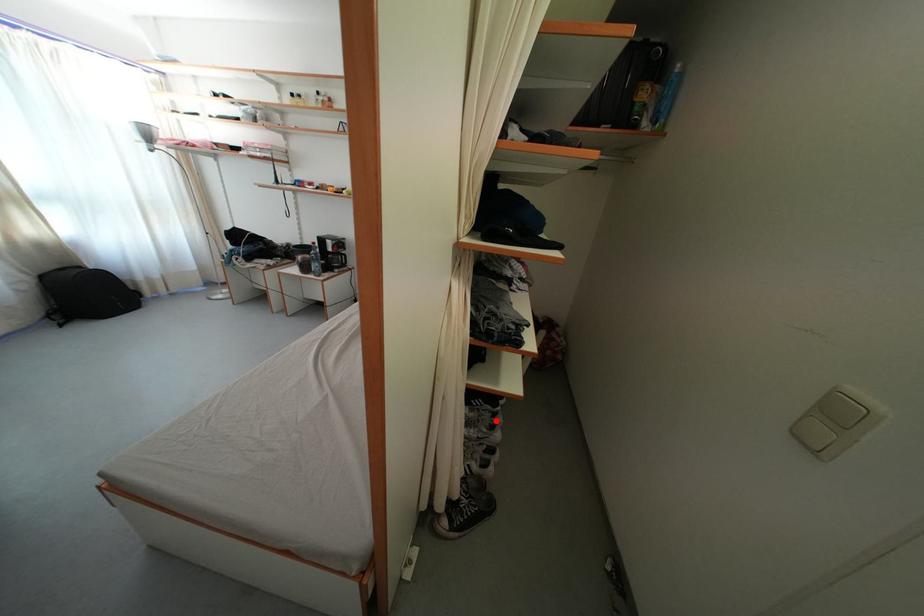
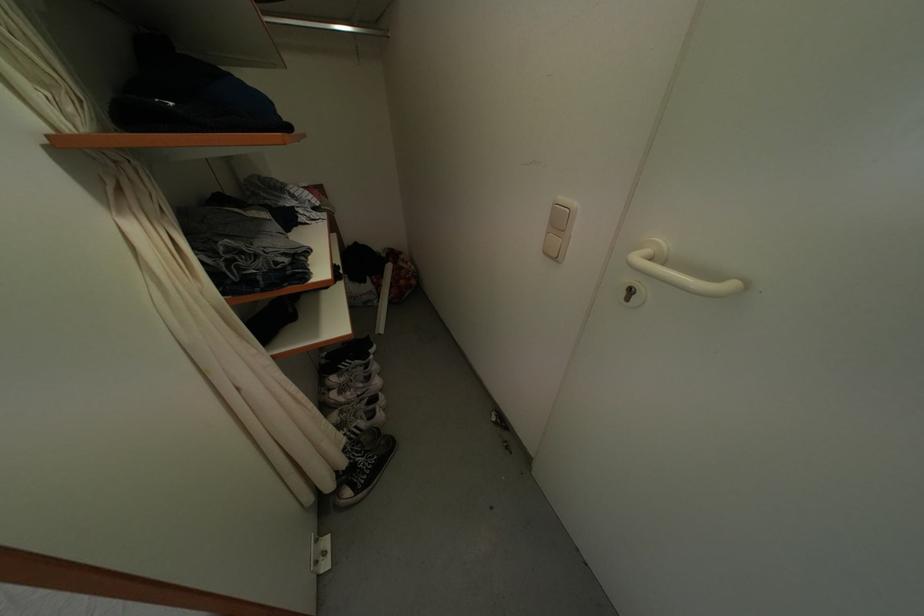
In the second image, find the point that corresponds to the highlighted location in the first image.

(369, 374)